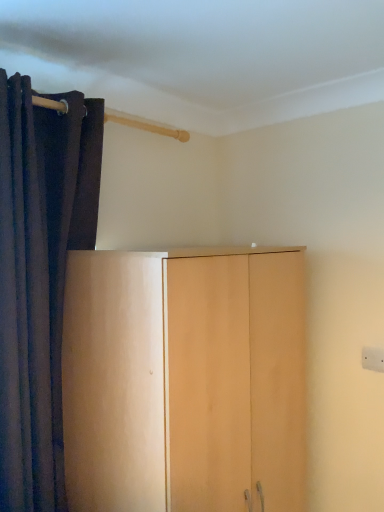
Question: Is point (150, 459) positioned closer to the camera than point (21, 270)?

Choices:
 (A) farther
 (B) closer

Answer: (B)

Question: Is light wood cupboard at center inside or outside of dark velvet curtain at left?

Choices:
 (A) outside
 (B) inside

Answer: (A)

Question: Based on their sizes in the image, would you say light wood cupboard at center is bigger or smaller than dark velvet curtain at left?

Choices:
 (A) big
 (B) small

Answer: (A)

Question: In the image, is dark velvet curtain at left on the left side or the right side of light wood cupboard at center?

Choices:
 (A) right
 (B) left

Answer: (B)

Question: Is dark velvet curtain at left inside the boundaries of light wood cupboard at center, or outside?

Choices:
 (A) outside
 (B) inside

Answer: (A)

Question: Is dark velvet curtain at left bigger or smaller than light wood cupboard at center?

Choices:
 (A) small
 (B) big

Answer: (A)

Question: Is point (3, 364) positioned closer to the camera than point (76, 268)?

Choices:
 (A) closer
 (B) farther

Answer: (A)